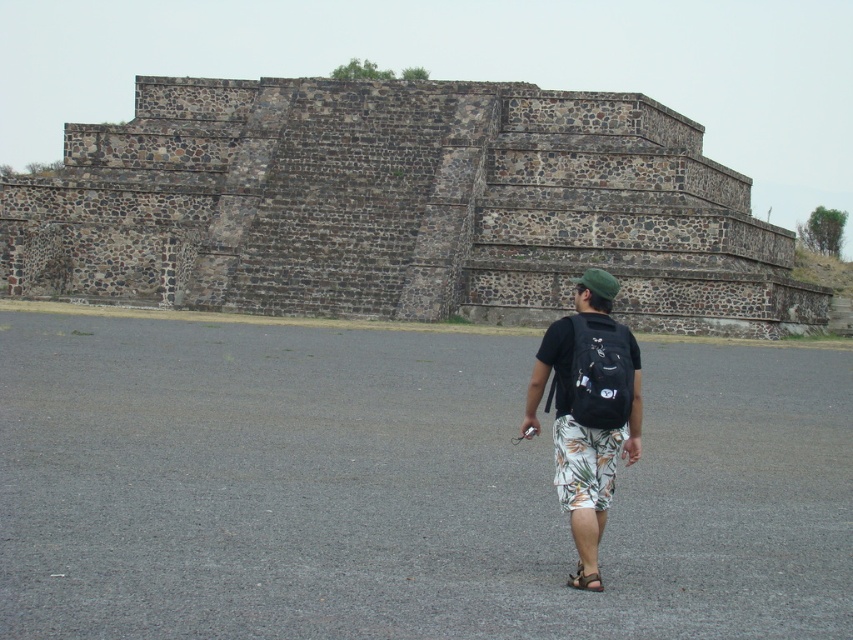
Question: Can you confirm if printed cotton shorts at center is wider than black fabric backpack at center?

Choices:
 (A) no
 (B) yes

Answer: (B)

Question: Can you confirm if black fabric backpack at center is positioned below brown leather sandal at lower center?

Choices:
 (A) yes
 (B) no

Answer: (B)

Question: Which object is closer to the camera taking this photo?

Choices:
 (A) brown leather sandal at lower center
 (B) black fabric backpack at center

Answer: (A)

Question: Which point is farther to the camera?

Choices:
 (A) (582, 588)
 (B) (563, 442)
 (C) (717, 164)

Answer: (C)

Question: Which point is closer to the camera?

Choices:
 (A) (596, 580)
 (B) (631, 141)
 (C) (607, 492)
 (D) (572, 412)

Answer: (A)

Question: Where is rustic stone pyramid at center located in relation to printed cotton shorts at center in the image?

Choices:
 (A) above
 (B) below

Answer: (A)